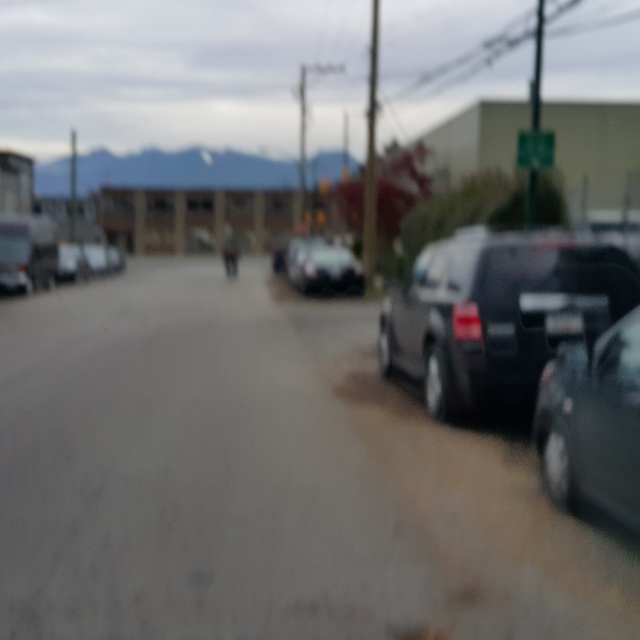
Which of these two, matte black van at right or satin black car at right, stands taller?

matte black van at right

Can you confirm if matte black van at right is smaller than satin black car at right?

Incorrect, matte black van at right is not smaller in size than satin black car at right.

Is point (632, 294) less distant than point (593, 445)?

No, it is behind (593, 445).

Locate an element on the screen. matte black van at right is located at coordinates (497, 310).

Is matte black van at right further to the viewer compared to satin black car at center?

No, it is in front of satin black car at center.

Who is positioned more to the left, matte black van at right or satin black car at center?

satin black car at center

The width and height of the screenshot is (640, 640). What are the coordinates of `matte black van at right` in the screenshot? It's located at (497, 310).

Find the location of a particular element. matte black van at right is located at coordinates (497, 310).

Is satin black car at right below satin black car at center?

Indeed, satin black car at right is positioned under satin black car at center.

Is point (552, 368) closer to viewer compared to point (300, 253)?

Yes.

What do you see at coordinates (593, 422) in the screenshot? I see `satin black car at right` at bounding box center [593, 422].

Locate an element on the screen. The image size is (640, 640). satin black car at right is located at coordinates (593, 422).